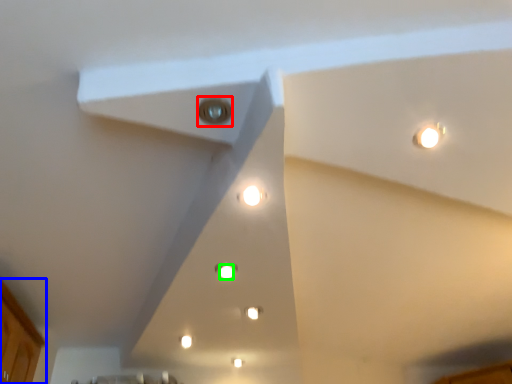
Question: Which is farther away from light (highlighted by a red box)? cabinetry (highlighted by a blue box) or light (highlighted by a green box)?

Choices:
 (A) cabinetry
 (B) light

Answer: (A)